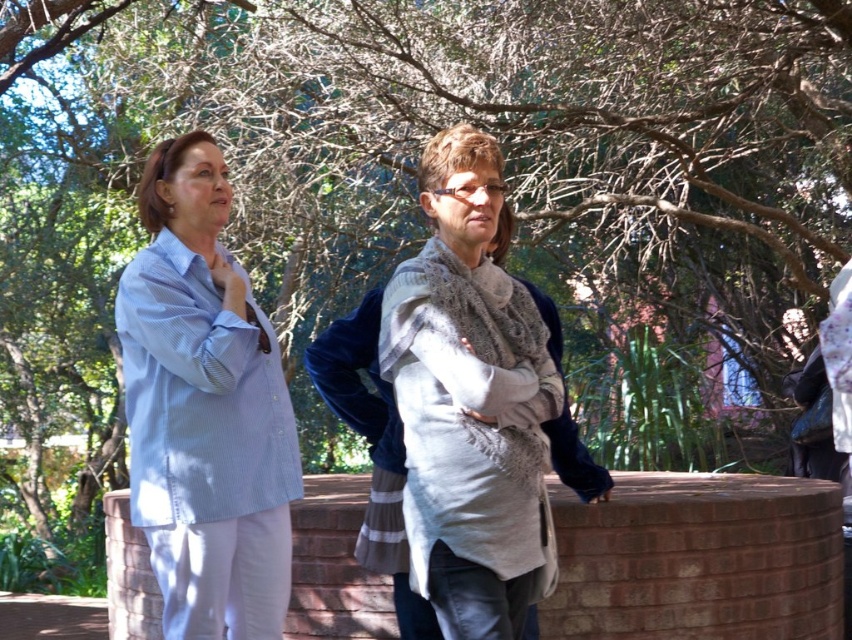
Based on the photo, you are a photographer trying to capture both the light blue striped shirt at left and the knitted gray scarf at center in a single frame. Since you want both to be clearly visible, which object should you focus on first to ensure proper exposure, considering their sizes?

The light blue striped shirt at left has a larger size compared to the knitted gray scarf at center, so you should focus on the light blue striped shirt at left first to ensure proper exposure.

You are a photographer trying to capture a candid shot of both the light blue striped shirt at left and the knitted gray scarf at center. Based on their positions, which one is closer to the camera?

The light blue striped shirt at left is closer to the camera because the knitted gray scarf at center is positioned behind it.